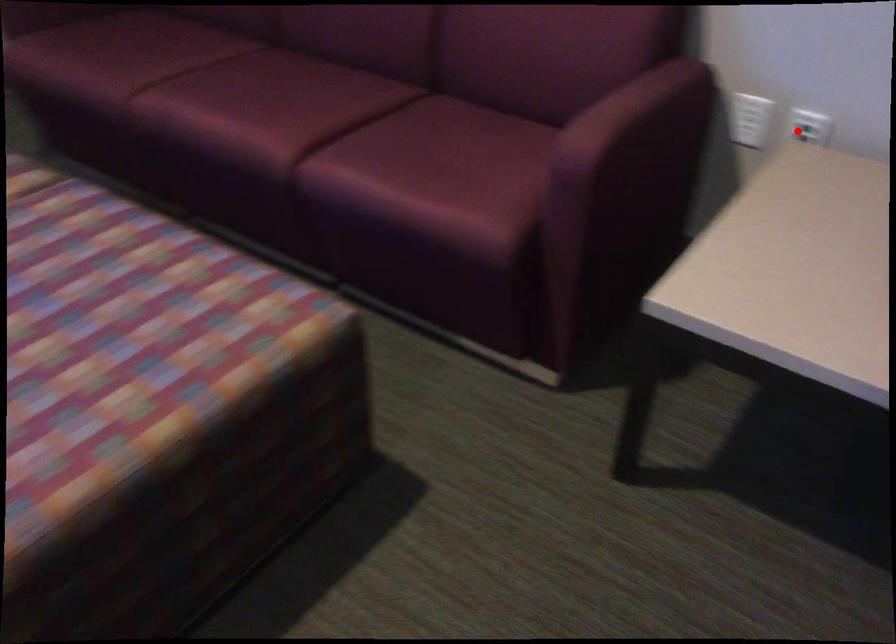
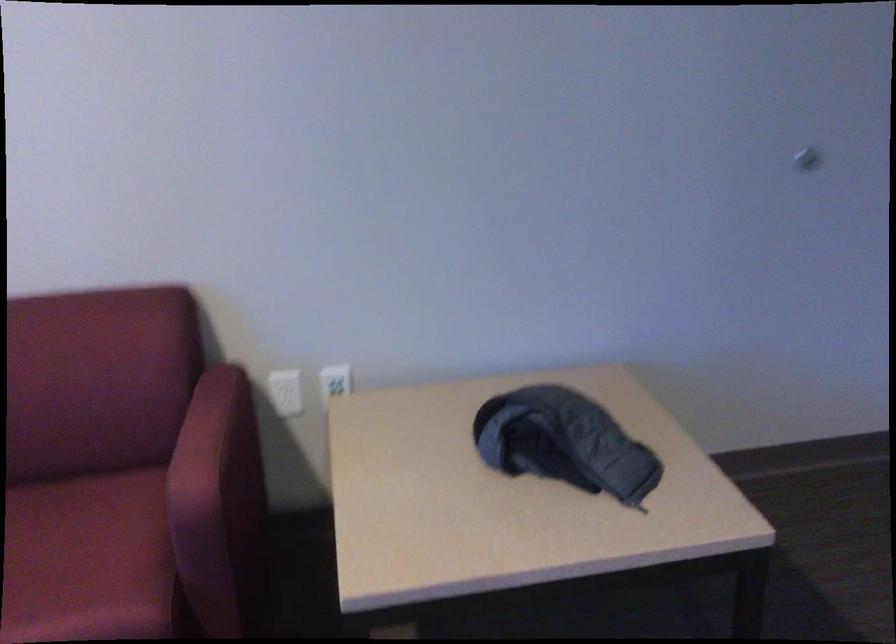
Where in the second image is the point corresponding to the highlighted location from the first image?

(334, 382)